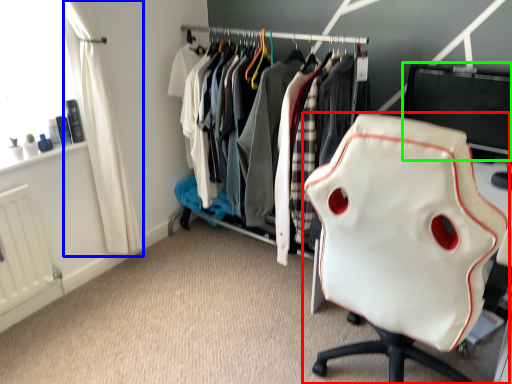
Question: Which object is positioned closest to chair (highlighted by a red box)? Select from curtain (highlighted by a blue box) and desktop (highlighted by a green box).

Choices:
 (A) curtain
 (B) desktop

Answer: (B)